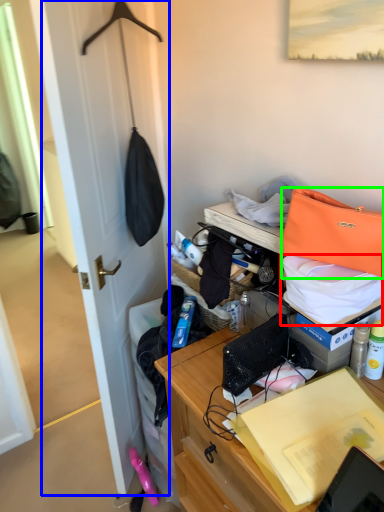
Question: Estimate the real-world distances between objects in this image. Which object is farther from kit (highlighted by a red box), door (highlighted by a blue box) or handbag (highlighted by a green box)?

Choices:
 (A) door
 (B) handbag

Answer: (A)